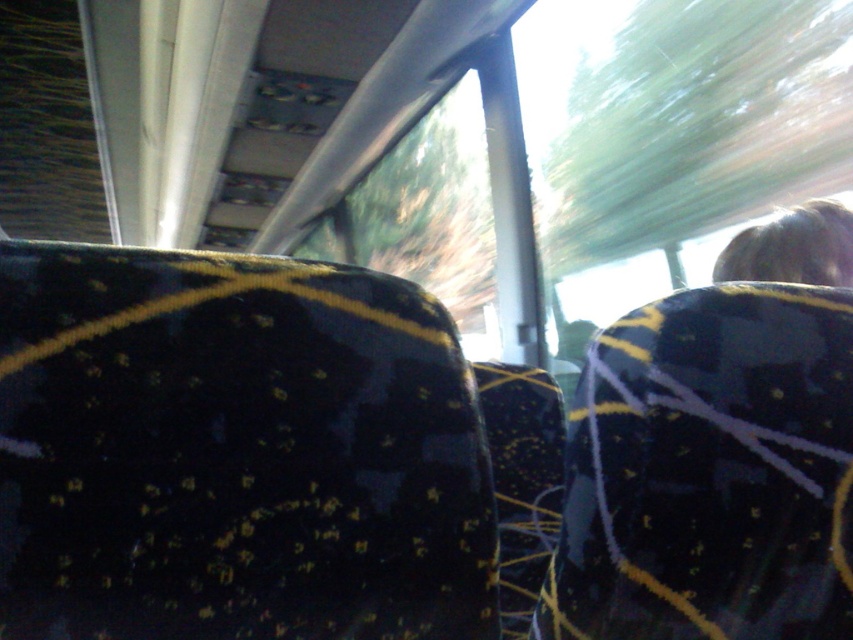
Question: Is velvet-like dark blue seat at right above transparent glass window at upper center?

Choices:
 (A) yes
 (B) no

Answer: (B)

Question: Which point appears closest to the camera in this image?

Choices:
 (A) pos(837,216)
 (B) pos(604,152)
 (C) pos(79,134)
 (D) pos(811,460)

Answer: (D)

Question: In this image, where is transparent plastic window at upper left located relative to blonde hair at upper right?

Choices:
 (A) right
 (B) left

Answer: (B)

Question: Which point is closer to the camera?

Choices:
 (A) transparent glass window at upper center
 (B) blonde hair at upper right
 (C) transparent plastic window at upper left
 (D) transparent glass window at center

Answer: (B)

Question: Does transparent plastic window at upper left have a greater width compared to blonde hair at upper right?

Choices:
 (A) no
 (B) yes

Answer: (B)

Question: Which object is the farthest from the velvet-like dark blue seat at right?

Choices:
 (A) transparent glass window at upper center
 (B) blonde hair at upper right

Answer: (A)